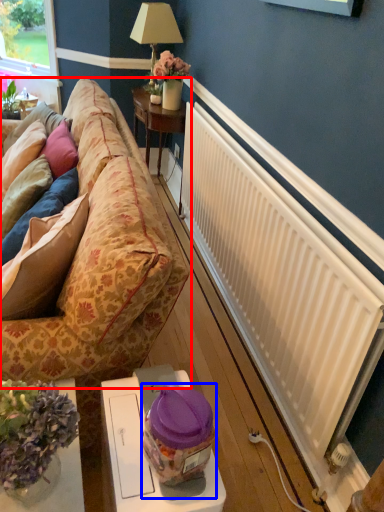
Question: Which object is further to the camera taking this photo, studio couch (highlighted by a red box) or food (highlighted by a blue box)?

Choices:
 (A) studio couch
 (B) food

Answer: (A)